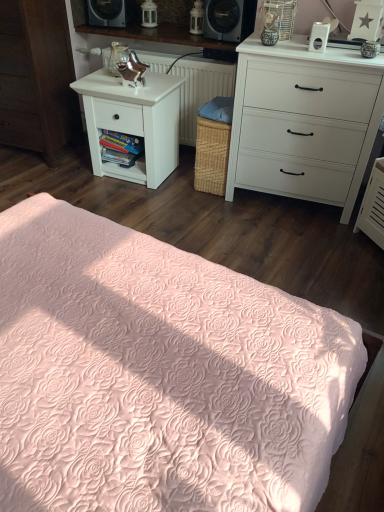
Question: Is white textured radiator at center in front of white wood nightstand at left?

Choices:
 (A) yes
 (B) no

Answer: (B)

Question: Considering the relative positions of white textured radiator at center and white wood nightstand at left in the image provided, is white textured radiator at center to the left of white wood nightstand at left from the viewer's perspective?

Choices:
 (A) no
 (B) yes

Answer: (A)

Question: Is white textured radiator at center thinner than white wood nightstand at left?

Choices:
 (A) no
 (B) yes

Answer: (A)

Question: Does white textured radiator at center appear on the right side of white wood nightstand at left?

Choices:
 (A) no
 (B) yes

Answer: (B)

Question: Is white textured radiator at center wider than white wood nightstand at left?

Choices:
 (A) yes
 (B) no

Answer: (A)

Question: Can you confirm if white textured radiator at center is shorter than white wood nightstand at left?

Choices:
 (A) yes
 (B) no

Answer: (A)

Question: Does white matte chest of drawers at upper right have a smaller size compared to white matte nightstand at left?

Choices:
 (A) yes
 (B) no

Answer: (B)

Question: Is white matte chest of drawers at upper right closer to the viewer compared to white matte nightstand at left?

Choices:
 (A) yes
 (B) no

Answer: (A)

Question: Does white matte chest of drawers at upper right have a greater width compared to white matte nightstand at left?

Choices:
 (A) yes
 (B) no

Answer: (A)

Question: From a real-world perspective, is white matte chest of drawers at upper right beneath white matte nightstand at left?

Choices:
 (A) yes
 (B) no

Answer: (B)

Question: Is white matte chest of drawers at upper right next to white matte nightstand at left?

Choices:
 (A) yes
 (B) no

Answer: (B)

Question: Considering the relative sizes of white matte chest of drawers at upper right and white matte nightstand at left in the image provided, is white matte chest of drawers at upper right bigger than white matte nightstand at left?

Choices:
 (A) yes
 (B) no

Answer: (A)

Question: From a real-world perspective, is white matte nightstand at left over white textured radiator at center?

Choices:
 (A) yes
 (B) no

Answer: (B)